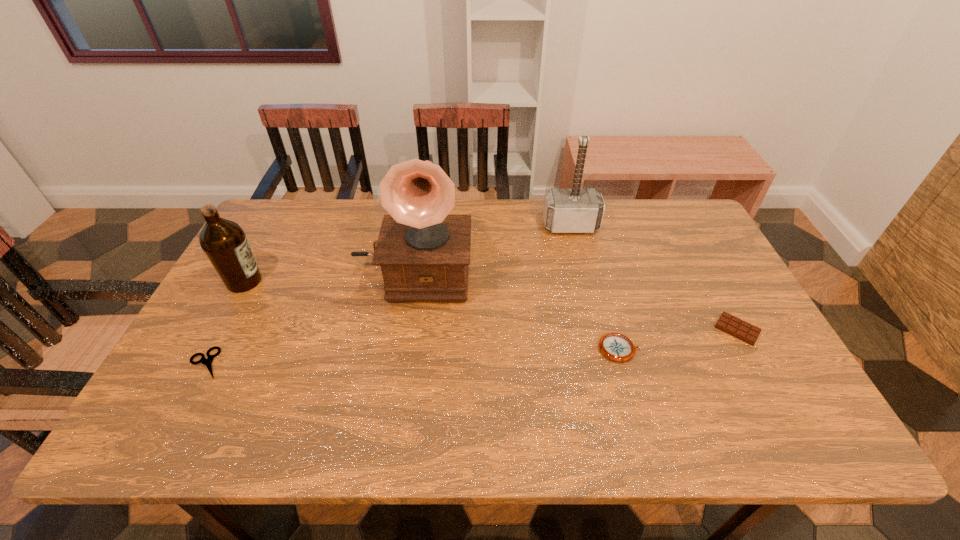
Locate an element on the screen. The image size is (960, 540). unoccupied position between the fifth shortest object and the record player is located at coordinates (492, 249).

At what (x,y) coordinates should I click in order to perform the action: click on vacant space that's between the second tallest object and the tallest object. Please return your answer as a coordinate pair (x, y). The image size is (960, 540). Looking at the image, I should click on (492, 249).

Image resolution: width=960 pixels, height=540 pixels. Find the location of `free space between the fifth shortest object and the compass`. free space between the fifth shortest object and the compass is located at coordinates (595, 287).

I want to click on unoccupied area between the second shortest object and the hammer, so click(x=654, y=278).

The image size is (960, 540). I want to click on vacant space in between the fourth object from right to left and the compass, so click(516, 310).

At what (x,y) coordinates should I click in order to perform the action: click on object that stands as the second closest to the olive oil. Please return your answer as a coordinate pair (x, y). Looking at the image, I should click on (424, 252).

Identify which object is the third closest to the fourth object from right to left. Please provide its 2D coordinates. Your answer should be formatted as a tuple, i.e. [(x, y)], where the tuple contains the x and y coordinates of a point satisfying the conditions above.

[(208, 362)]

The image size is (960, 540). I want to click on vacant point that satisfies the following two spatial constraints: 1. on the horn of the rightmost object; 2. on the left side of the record player, so click(x=404, y=329).

Locate an element on the screen. This screenshot has width=960, height=540. vacant position in the image that satisfies the following two spatial constraints: 1. for striking with the head of the rightmost object; 2. on the right side of the hammer is located at coordinates (595, 329).

At what (x,y) coordinates should I click in order to perform the action: click on vacant space that satisfies the following two spatial constraints: 1. on the horn of the record player; 2. on the right side of the third shortest object. Please return your answer as a coordinate pair (x, y). The image size is (960, 540). Looking at the image, I should click on (401, 349).